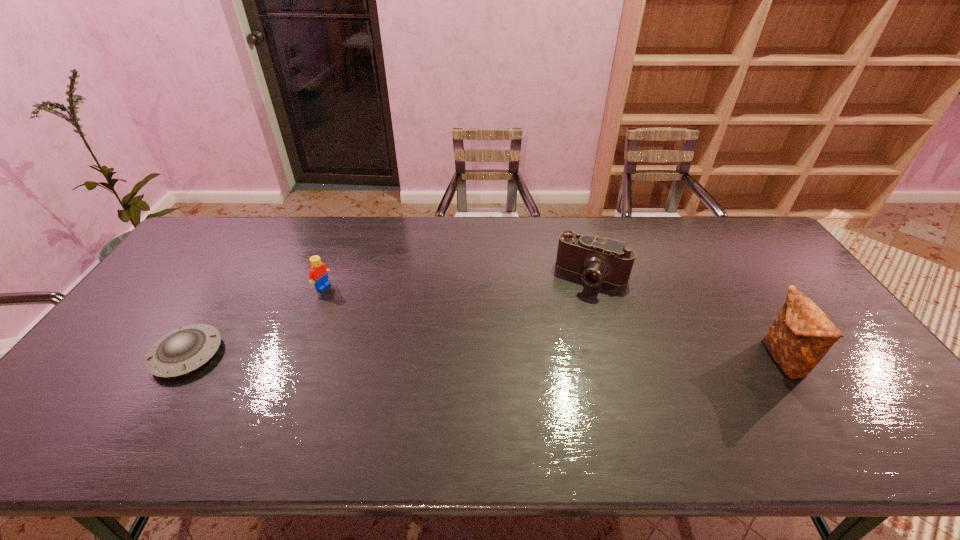
Where is `free space on the desktop that is between the saucer and the rightmost object and is positioned on the front-facing side of the third object from left to right`? free space on the desktop that is between the saucer and the rightmost object and is positioned on the front-facing side of the third object from left to right is located at coordinates (552, 358).

The width and height of the screenshot is (960, 540). What are the coordinates of `vacant space on the desktop that is between the saucer and the tallest object and is positioned on the face of the Lego` in the screenshot? It's located at (462, 357).